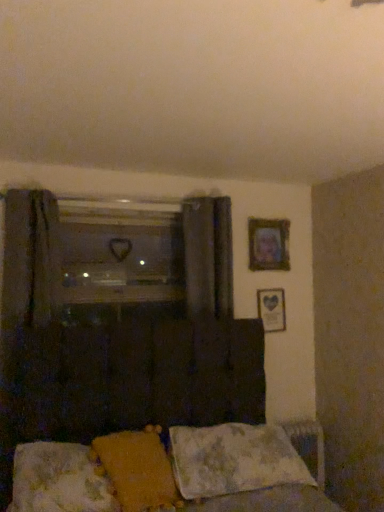
Question: Does wooden framed picture at upper right, which appears as the 1th picture frame when ordered from the bottom, have a lesser height compared to yellow fabric pillow at lower center, marked as the 2th pillow in a right-to-left arrangement?

Choices:
 (A) no
 (B) yes

Answer: (A)

Question: Does wooden framed picture at upper right, which appears as the 1th picture frame when ordered from the bottom, lie behind yellow fabric pillow at lower center, placed as the second pillow when sorted from left to right?

Choices:
 (A) no
 (B) yes

Answer: (B)

Question: Would you consider wooden framed picture at upper right, which ranks as the 2th picture frame in top-to-bottom order, to be distant from yellow fabric pillow at lower center, marked as the 2th pillow in a right-to-left arrangement?

Choices:
 (A) yes
 (B) no

Answer: (A)

Question: From the image's perspective, is wooden framed picture at upper right, which appears as the 1th picture frame when ordered from the bottom, over yellow fabric pillow at lower center, placed as the second pillow when sorted from left to right?

Choices:
 (A) no
 (B) yes

Answer: (B)

Question: Is wooden framed picture at upper right, which ranks as the 2th picture frame in top-to-bottom order, facing away from yellow fabric pillow at lower center, marked as the 2th pillow in a right-to-left arrangement?

Choices:
 (A) no
 (B) yes

Answer: (A)

Question: Is transparent glass window at center taller or shorter than wooden framed picture at upper right, which ranks as the 2th picture frame in top-to-bottom order?

Choices:
 (A) tall
 (B) short

Answer: (A)

Question: From a real-world perspective, is transparent glass window at center positioned above or below wooden framed picture at upper right, which appears as the 1th picture frame when ordered from the bottom?

Choices:
 (A) above
 (B) below

Answer: (A)

Question: Relative to wooden framed picture at upper right, which ranks as the 2th picture frame in top-to-bottom order, is transparent glass window at center in front or behind?

Choices:
 (A) behind
 (B) front

Answer: (B)

Question: From the image's perspective, is transparent glass window at center above or below wooden framed picture at upper right, which appears as the 1th picture frame when ordered from the bottom?

Choices:
 (A) below
 (B) above

Answer: (B)

Question: Choose the correct answer: Is transparent glass window at center inside fluffy white pillow at lower center, which ranks as the 3th pillow in right-to-left order, or outside it?

Choices:
 (A) inside
 (B) outside

Answer: (B)

Question: Based on their sizes in the image, would you say transparent glass window at center is bigger or smaller than fluffy white pillow at lower center, which ranks as the 3th pillow in right-to-left order?

Choices:
 (A) big
 (B) small

Answer: (B)

Question: From the image's perspective, is transparent glass window at center above or below fluffy white pillow at lower center, which ranks as the 3th pillow in right-to-left order?

Choices:
 (A) below
 (B) above

Answer: (B)

Question: Considering their positions, is transparent glass window at center located in front of or behind fluffy white pillow at lower center, which ranks as the 1th pillow in left-to-right order?

Choices:
 (A) front
 (B) behind

Answer: (B)

Question: In the image, is fluffy fabric bed at lower center positioned in front of or behind wooden picture frame at upper right, which is counted as the second picture frame, starting from the bottom?

Choices:
 (A) behind
 (B) front

Answer: (B)

Question: Is fluffy fabric bed at lower center inside the boundaries of wooden picture frame at upper right, which is counted as the second picture frame, starting from the bottom, or outside?

Choices:
 (A) outside
 (B) inside

Answer: (A)